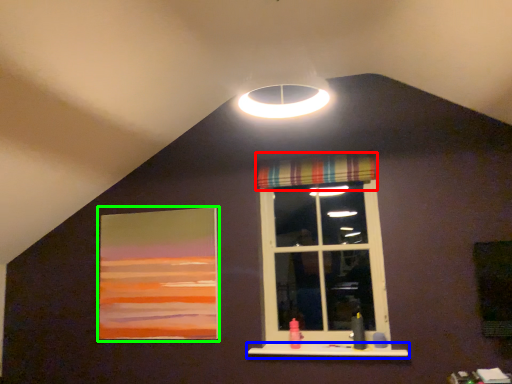
Question: Which is farther away from curtain (highlighted by a red box)? window sill (highlighted by a blue box) or picture frame (highlighted by a green box)?

Choices:
 (A) window sill
 (B) picture frame

Answer: (A)